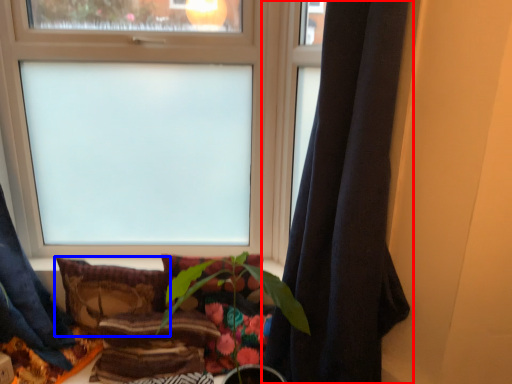
Question: Which of the following is the closest to the observer, curtain (highlighted by a red box) or pillow (highlighted by a blue box)?

Choices:
 (A) curtain
 (B) pillow

Answer: (A)